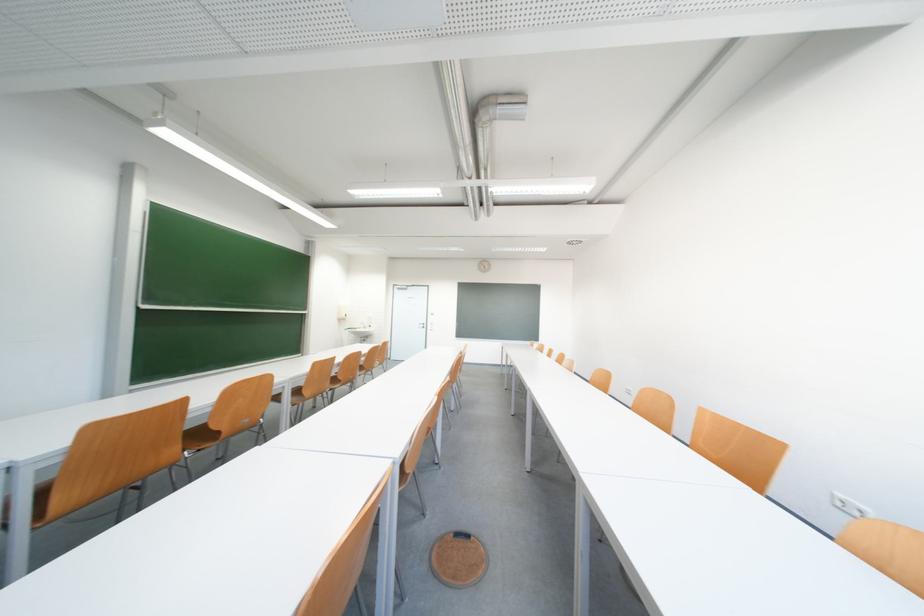
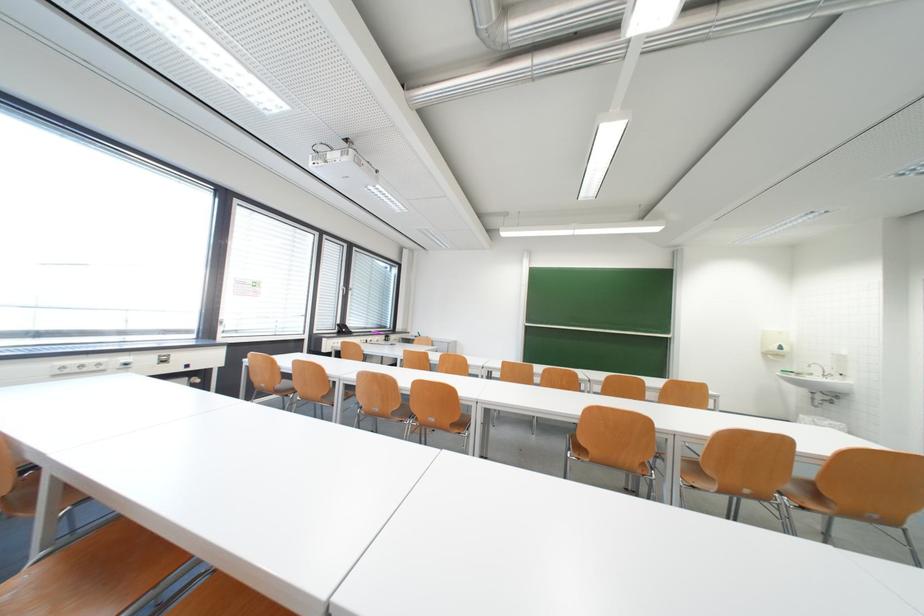
In the second image, find the point that corresponds to (x=201, y=407) in the first image.

(439, 359)